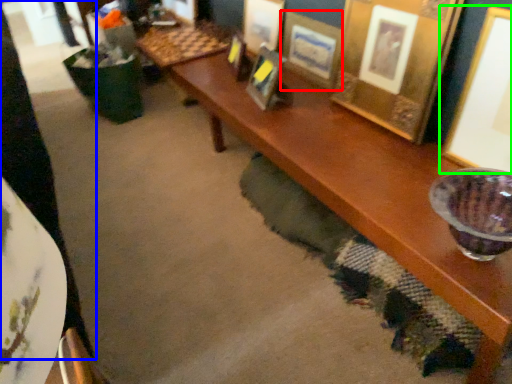
Question: Which object is positioned closest to picture frame (highlighted by a red box)? Select from person (highlighted by a blue box) and picture frame (highlighted by a green box).

Choices:
 (A) person
 (B) picture frame

Answer: (B)